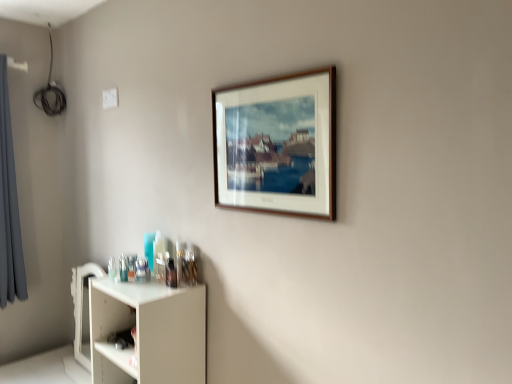
Question: From a real-world perspective, is white matte shelf at lower left above or below wooden picture frame at upper center?

Choices:
 (A) below
 (B) above

Answer: (A)

Question: Is white matte shelf at lower left wider or thinner than wooden picture frame at upper center?

Choices:
 (A) wide
 (B) thin

Answer: (A)

Question: Estimate the real-world distances between objects in this image. Which object is farther from the gray fabric curtain at left?

Choices:
 (A) wooden picture frame at upper center
 (B) white matte shelf at lower left

Answer: (A)

Question: Which of these objects is positioned farthest from the gray fabric curtain at left?

Choices:
 (A) white matte shelf at lower left
 (B) wooden picture frame at upper center

Answer: (B)